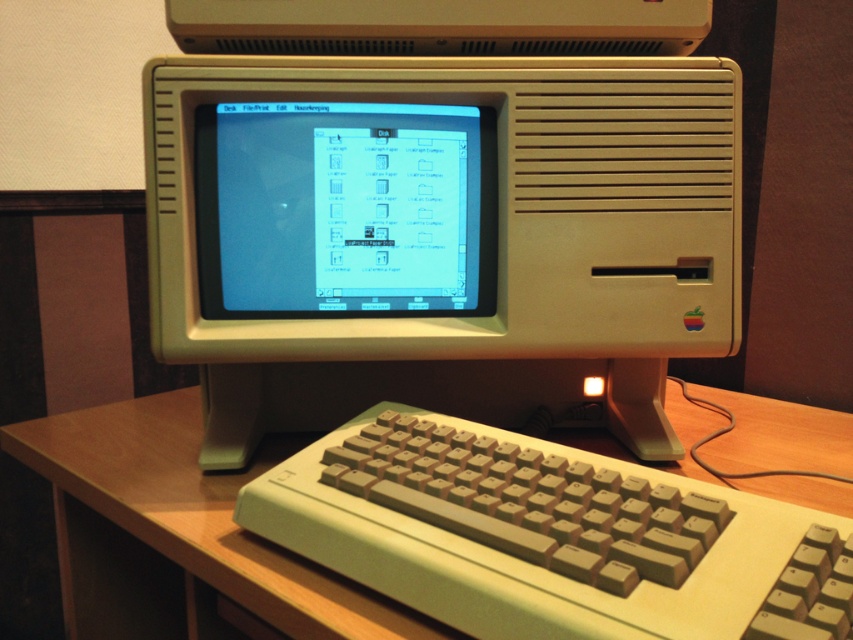
Question: Can you confirm if beige plastic desktop computer at center is positioned to the left of matte plastic screen at center?

Choices:
 (A) yes
 (B) no

Answer: (B)

Question: Which of the following is the closest to the observer?

Choices:
 (A) pyautogui.click(x=183, y=572)
 (B) pyautogui.click(x=218, y=244)

Answer: (B)

Question: Based on their relative distances, which object is nearer to the beige plastic desktop computer at center?

Choices:
 (A) wooden at center
 (B) matte plastic screen at center

Answer: (B)

Question: Is beige plastic desktop computer at center positioned in front of matte plastic screen at center?

Choices:
 (A) yes
 (B) no

Answer: (A)

Question: Is beige plastic desktop computer at center wider than matte plastic screen at center?

Choices:
 (A) no
 (B) yes

Answer: (B)

Question: Estimate the real-world distances between objects in this image. Which object is closer to the wooden at center?

Choices:
 (A) beige plastic desktop computer at center
 (B) matte plastic screen at center

Answer: (B)